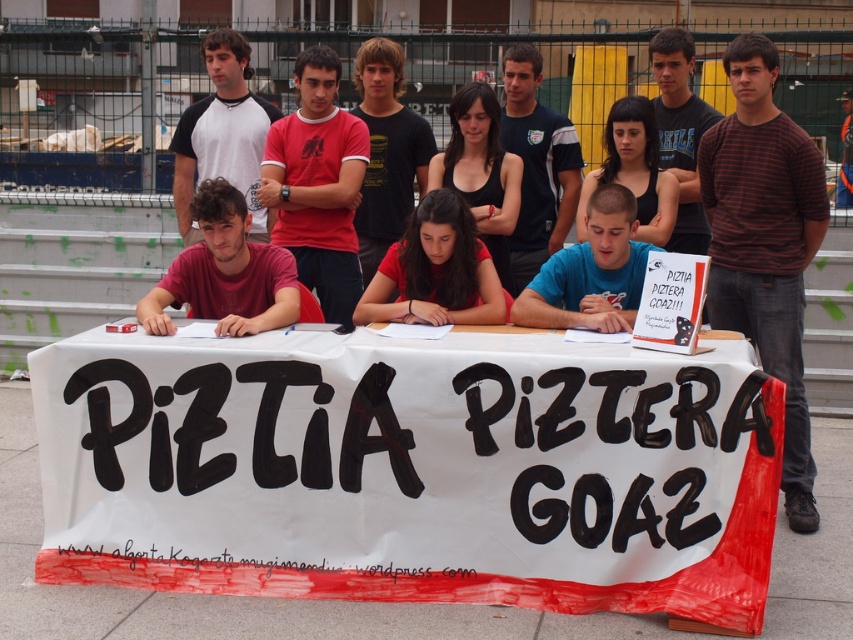
You are a photographer standing at the edge of the crowd. You want to capture a photo that includes both the matte red shirt at center and the matte black tank top at center in the same frame. Given that your camera has a minimum focus distance of 30 inches, will you be able to achieve this?

The distance between the matte red shirt at center and the matte black tank top at center is 36.73 inches, which is greater than the camera minimum focus distance of 30 inches. Therefore, you can capture both in the same frame.

In the scene shown: You are organizing a small event and need to place a 1.5 meter long banner on the table. Given the white paper table at center and the matte red shirt at center, which object can accommodate the banner without overlapping the shirt?

The white paper table at center is bigger than the matte red shirt at center, so the banner can be placed on the white paper table at center without overlapping the shirt.